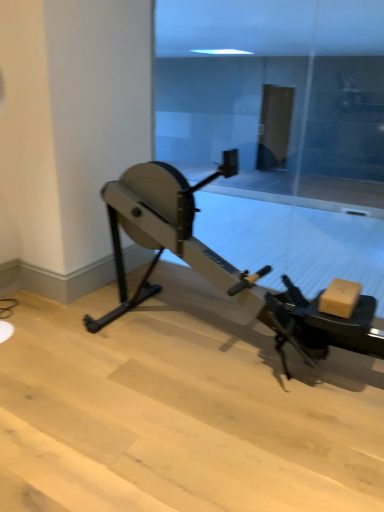
You are a GUI agent. You are given a task and a screenshot of the screen. Output one action in this format:
    pyautogui.click(x=<x>, y=<y>)
    Task: Click on the free space in front of metallic gray stationary bicycle at center
    This screenshot has height=512, width=384.
    Given the screenshot: What is the action you would take?
    pyautogui.click(x=203, y=440)